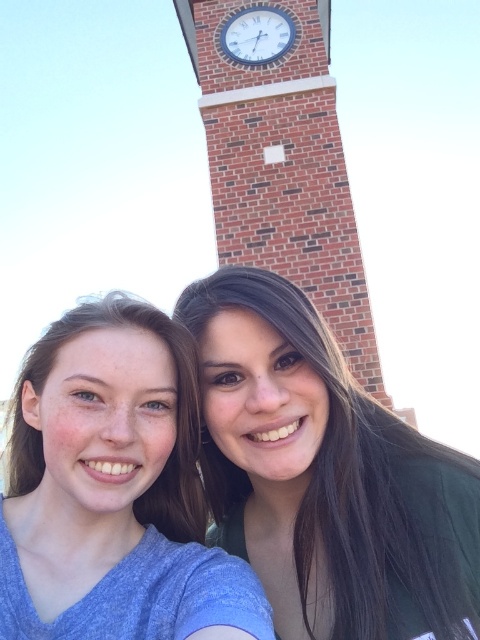
You are taking a selfie with a friend in front of the brick clock tower at center. Your friend is wearing a matte blue shirt at lower left. From your perspective, which object is taller?

The brick clock tower at center is taller than the matte blue shirt at lower left.

You are taking a photo of the scene described. The matte blue shirt at lower left and the white glossy clock at upper center are both in the frame. Which object is positioned to the left of the other?

The matte blue shirt at lower left is to the left of the white glossy clock at upper center.

You are taking a selfie with two friends in front of a brick clock tower. Your camera app shows a point at coordinates (283, 164). Where should you aim your camera to capture the brick clock tower at center?

The brick clock tower at center is represented by point (283, 164), so you should aim your camera at that coordinate to capture the brick clock tower at center.